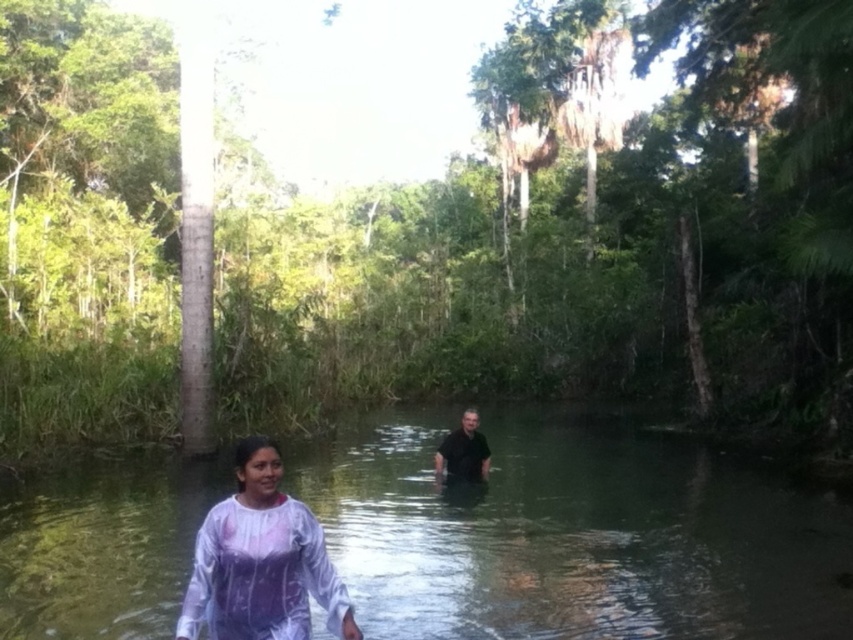
Locate an element on the screen. This screenshot has width=853, height=640. clear water at center is located at coordinates (573, 532).

Does clear water at center have a lesser width compared to black matte shirt at center?

No.

What are the coordinates of `clear water at center` in the screenshot? It's located at (573, 532).

Image resolution: width=853 pixels, height=640 pixels. What are the coordinates of `clear water at center` in the screenshot? It's located at (573, 532).

Based on the photo, does clear water at center lie in front of white matte dress at center?

That is False.

Who is more distant from viewer, (532, 444) or (225, 621)?

The point (532, 444) is behind.

The image size is (853, 640). I want to click on clear water at center, so click(573, 532).

Is point (316, 554) behind point (451, 436)?

No, it is in front of (451, 436).

Between white matte dress at center and black matte shirt at center, which one is positioned lower?

black matte shirt at center

Which is in front, point (189, 598) or point (440, 451)?

Positioned in front is point (189, 598).

Image resolution: width=853 pixels, height=640 pixels. Find the location of `white matte dress at center`. white matte dress at center is located at coordinates (260, 561).